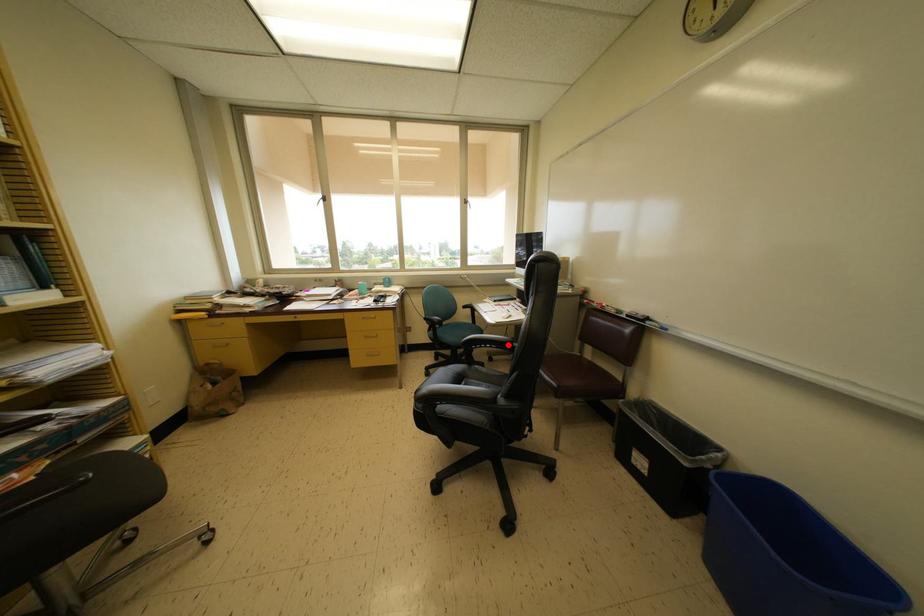
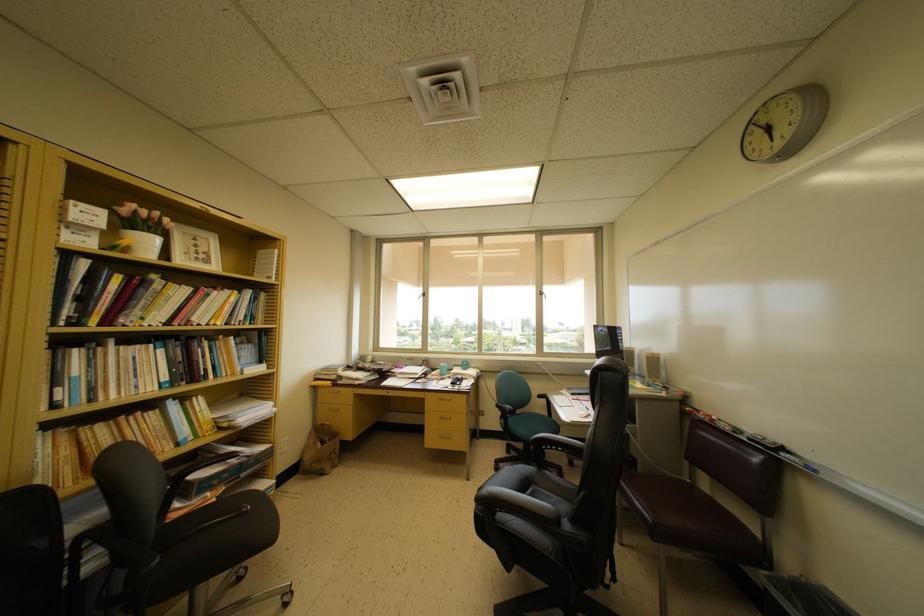
In the second image, find the point that corresponds to the highlighted location in the first image.

(582, 450)